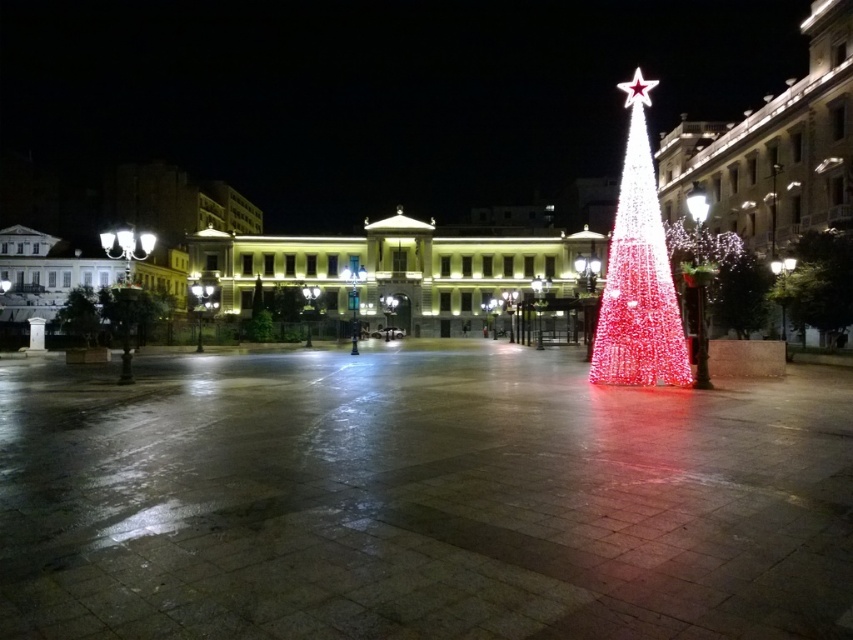
Question: Which point is closer to the camera?

Choices:
 (A) green leafy tree at left
 (B) illuminated plastic christmas tree at right

Answer: (B)

Question: Is illuminated white lights at center below illuminated plastic christmas tree at right?

Choices:
 (A) yes
 (B) no

Answer: (B)

Question: Which point is closer to the camera?

Choices:
 (A) [x=824, y=308]
 (B) [x=637, y=220]
 (C) [x=86, y=316]

Answer: (B)

Question: Does illuminated plastic christmas tree at right appear under green leafy tree at left?

Choices:
 (A) yes
 (B) no

Answer: (B)

Question: Can you confirm if illuminated plastic christmas tree at right is positioned above green leafy tree at left?

Choices:
 (A) yes
 (B) no

Answer: (A)

Question: Considering the real-world distances, which object is closest to the green leafy tree at left?

Choices:
 (A) illuminated plastic christmas tree at right
 (B) illuminated white lights at center

Answer: (B)